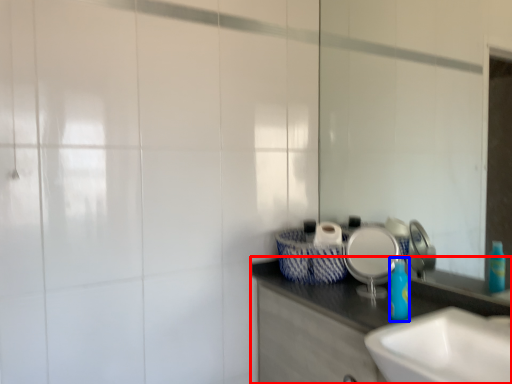
Question: Which point is further to the camera, bathroom cabinet (highlighted by a red box) or bottle (highlighted by a blue box)?

Choices:
 (A) bathroom cabinet
 (B) bottle

Answer: (B)